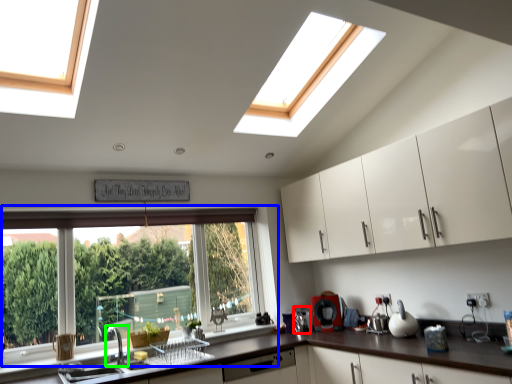
Question: Which is farther away from appliance (highlighted by a red box)? window (highlighted by a blue box) or tap (highlighted by a green box)?

Choices:
 (A) window
 (B) tap

Answer: (B)